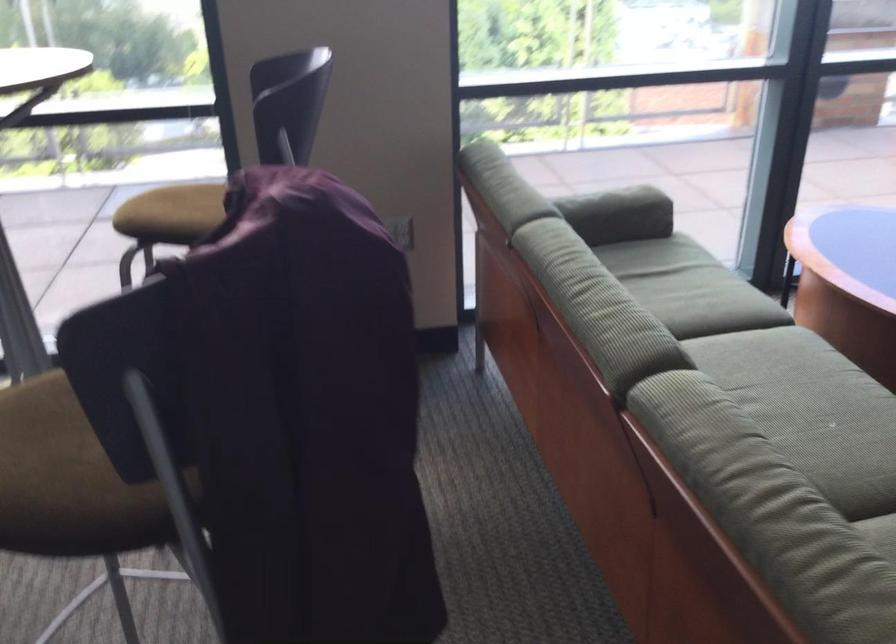
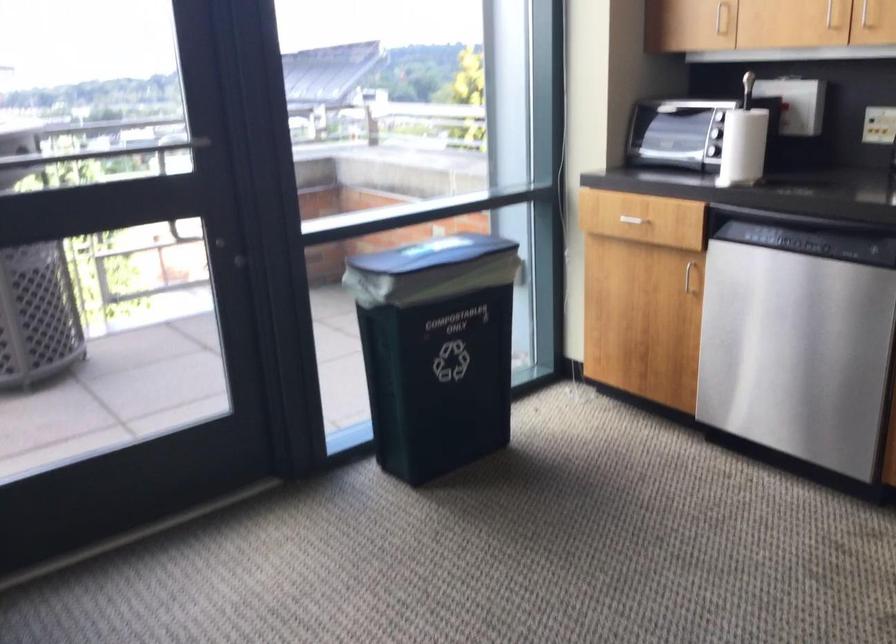
Question: What movement of the cameraman would produce the second image?

Choices:
 (A) Left
 (B) Right
 (C) Forward
 (D) Backward

Answer: (B)